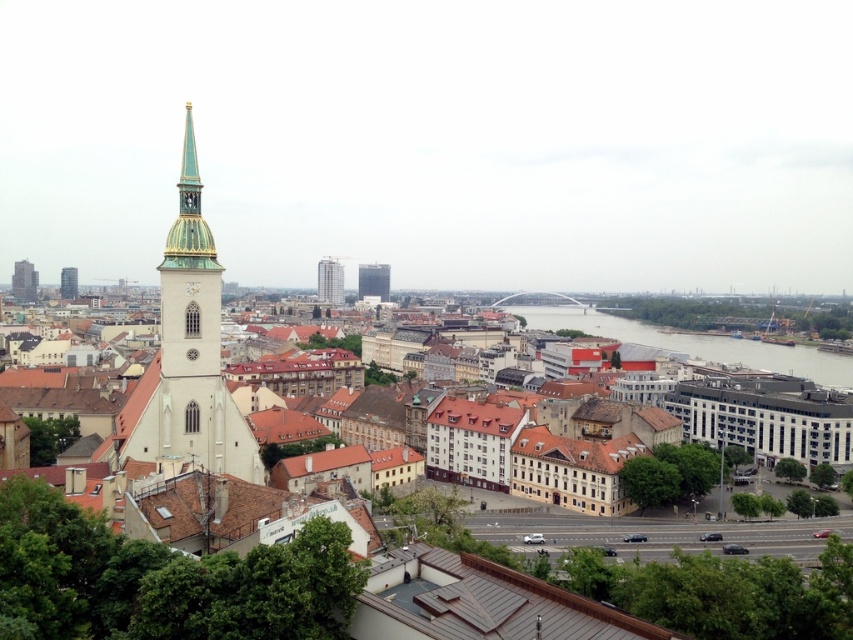
Which is more to the right, clear glass waterway at center or matte glass skyscraper at center?

From the viewer's perspective, clear glass waterway at center appears more on the right side.

Between point (701, 346) and point (376, 266), which one is positioned behind?

The point (701, 346) is behind.

Identify the location of clear glass waterway at center. This screenshot has width=853, height=640. (695, 342).

Does metallic glass tower at center come in front of matte white tower at left?

Yes.

Which is in front, point (335, 268) or point (22, 301)?

Point (335, 268) is more forward.

In order to click on metallic glass tower at center in this screenshot , I will do `click(329, 280)`.

Does matte glass skyscraper at center have a greater width compared to dark gray glass tower at upper left?

No, matte glass skyscraper at center is not wider than dark gray glass tower at upper left.

Where is `matte glass skyscraper at center`? matte glass skyscraper at center is located at coordinates (373, 280).

I want to click on matte glass skyscraper at center, so click(373, 280).